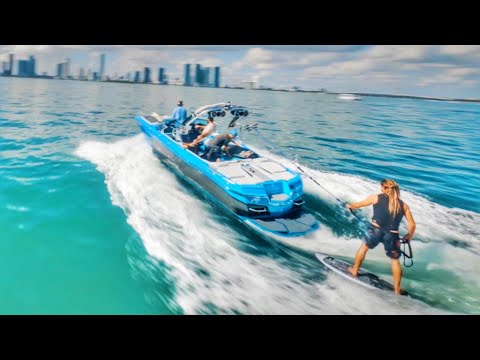
The height and width of the screenshot is (360, 480). I want to click on board, so click(368, 277).